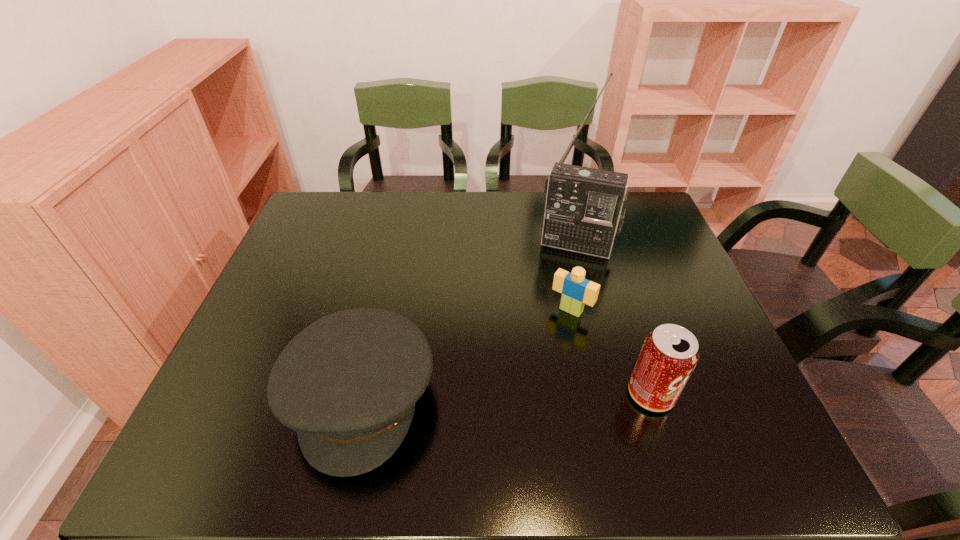
This screenshot has height=540, width=960. Identify the location of vacant area located 0.280m on the face of the Lego. (501, 403).

Find the location of a particular element. This screenshot has width=960, height=540. vacant space situated 0.240m on the face of the Lego is located at coordinates (511, 390).

What are the coordinates of `object situated at the far edge` in the screenshot? It's located at (585, 207).

The image size is (960, 540). Identify the location of beret positioned at the near edge. (348, 383).

Identify the location of soda can located at the near edge. The width and height of the screenshot is (960, 540). (669, 354).

The width and height of the screenshot is (960, 540). I want to click on object situated at the left edge, so click(x=348, y=383).

Locate an element on the screen. The image size is (960, 540). object present at the right edge is located at coordinates (669, 354).

Where is `object located in the near left corner section of the desktop`? object located in the near left corner section of the desktop is located at coordinates (348, 383).

The height and width of the screenshot is (540, 960). Identify the location of object situated at the near right corner. (669, 354).

In the image, there is a desktop. Identify the location of vacant space at the far edge. The image size is (960, 540). (540, 218).